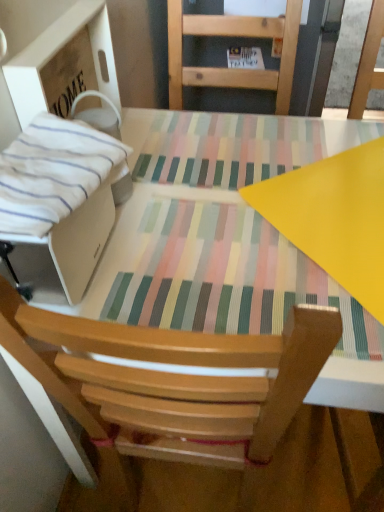
Question: Does matte plastic table at center appear on the right side of white cardboard box at left?

Choices:
 (A) yes
 (B) no

Answer: (A)

Question: From a real-world perspective, does matte plastic table at center stand above white cardboard box at left?

Choices:
 (A) yes
 (B) no

Answer: (B)

Question: Is the surface of matte plastic table at center in direct contact with white cardboard box at left?

Choices:
 (A) no
 (B) yes

Answer: (A)

Question: Considering the relative positions of matte plastic table at center and white cardboard box at left in the image provided, is matte plastic table at center behind white cardboard box at left?

Choices:
 (A) yes
 (B) no

Answer: (B)

Question: From the image's perspective, is matte plastic table at center below white cardboard box at left?

Choices:
 (A) no
 (B) yes

Answer: (B)

Question: From the image's perspective, is matte plastic table at center positioned above or below white striped fabric at left?

Choices:
 (A) below
 (B) above

Answer: (A)

Question: Looking at their shapes, would you say matte plastic table at center is wider or thinner than white striped fabric at left?

Choices:
 (A) thin
 (B) wide

Answer: (B)

Question: Considering the positions of point (288, 254) and point (104, 150), is point (288, 254) closer or farther from the camera than point (104, 150)?

Choices:
 (A) farther
 (B) closer

Answer: (A)

Question: From a real-world perspective, is matte plastic table at center above or below white striped fabric at left?

Choices:
 (A) below
 (B) above

Answer: (A)

Question: Is point (41, 170) closer or farther from the camera than point (102, 270)?

Choices:
 (A) farther
 (B) closer

Answer: (B)

Question: In terms of size, does white striped fabric at left appear bigger or smaller than matte plastic table at center?

Choices:
 (A) big
 (B) small

Answer: (B)

Question: Would you say white striped fabric at left is inside or outside matte plastic table at center?

Choices:
 (A) outside
 (B) inside

Answer: (A)

Question: From a real-world perspective, is white striped fabric at left positioned above or below matte plastic table at center?

Choices:
 (A) above
 (B) below

Answer: (A)

Question: Is point (69, 160) closer or farther from the camera than point (279, 324)?

Choices:
 (A) closer
 (B) farther

Answer: (A)

Question: In terms of height, does white cardboard box at left look taller or shorter compared to matte plastic table at center?

Choices:
 (A) tall
 (B) short

Answer: (B)